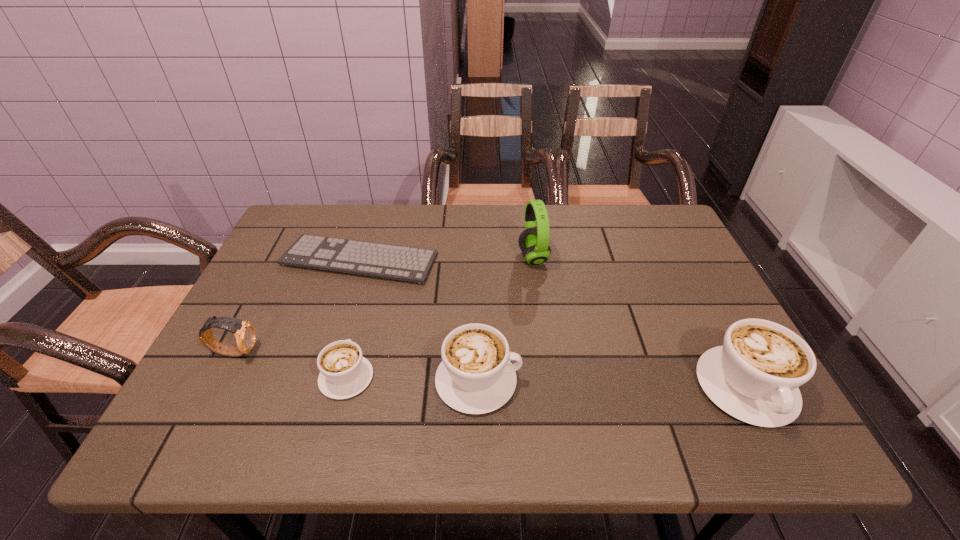
Image resolution: width=960 pixels, height=540 pixels. In order to click on object present at the right edge in this screenshot , I will do `click(754, 377)`.

Locate an element on the screen. object located in the far left corner section of the desktop is located at coordinates (403, 263).

Where is `object that is at the near right corner`? This screenshot has height=540, width=960. object that is at the near right corner is located at coordinates (754, 377).

Image resolution: width=960 pixels, height=540 pixels. In order to click on free space at the far edge of the desktop in this screenshot , I will do `click(464, 210)`.

This screenshot has height=540, width=960. What are the coordinates of `free region at the near edge of the desktop` in the screenshot? It's located at (317, 404).

Identify the location of free space at the left edge. This screenshot has width=960, height=540. (237, 361).

Find the location of `vacant space at the right edge`. vacant space at the right edge is located at coordinates click(x=692, y=309).

The image size is (960, 540). In order to click on vacant space at the far left corner of the desktop in this screenshot , I will do `click(283, 226)`.

Locate an element on the screen. The image size is (960, 540). free space at the far right corner of the desktop is located at coordinates (651, 242).

Identify the location of vacant region between the second cappuccino from right to left and the computer keyboard. The height and width of the screenshot is (540, 960). (419, 320).